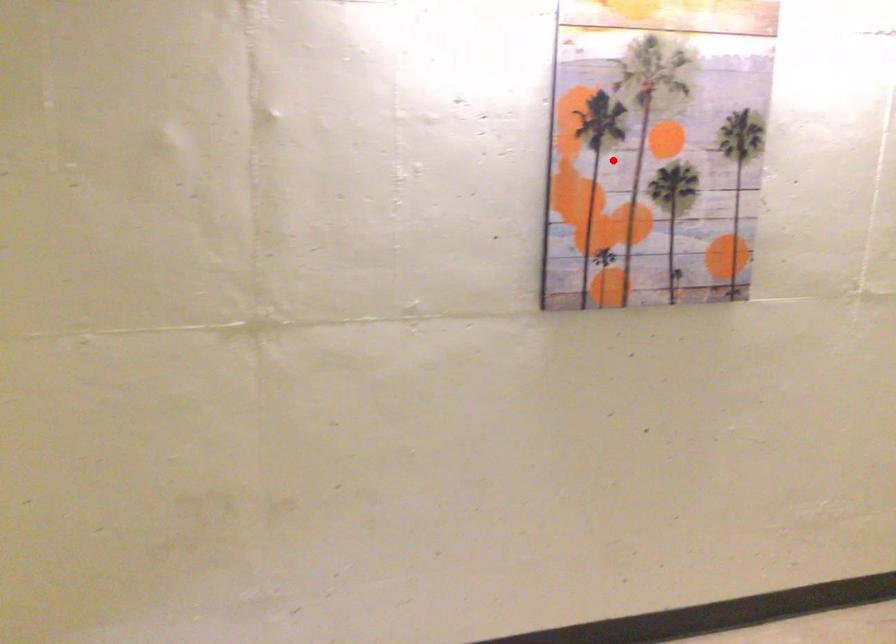
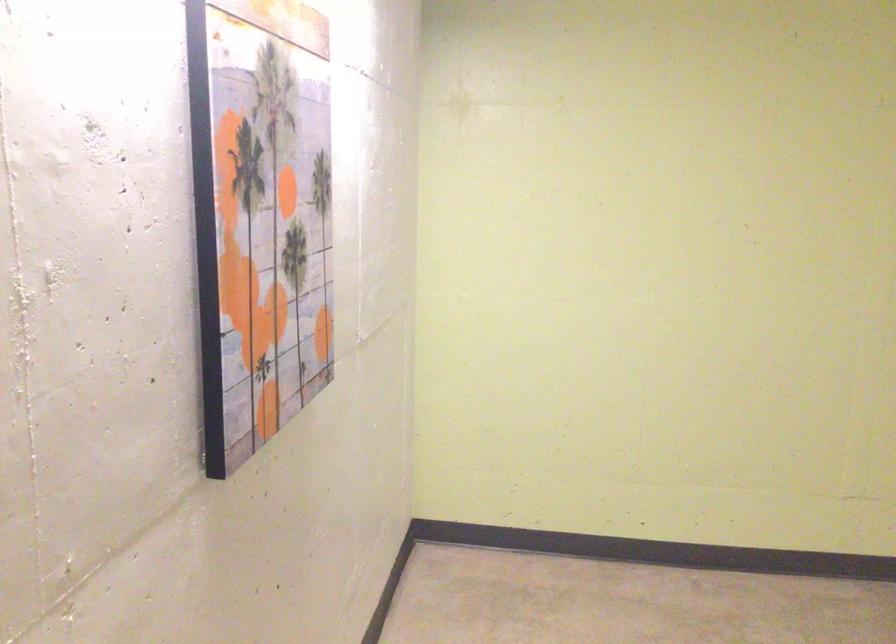
The point at the highlighted location is marked in the first image. Where is the corresponding point in the second image?

(260, 216)